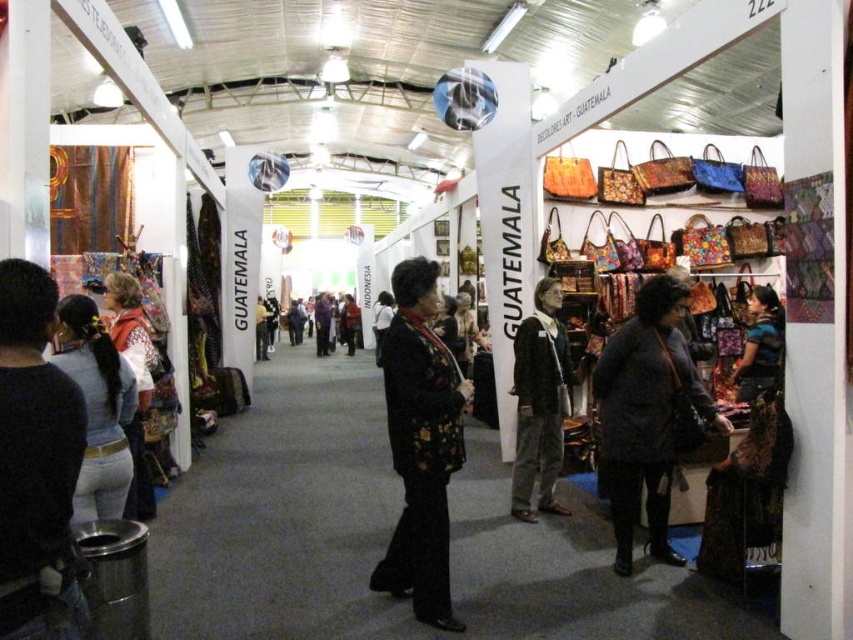
Question: Does black leather jacket at lower left come in front of red velvet coat at center?

Choices:
 (A) no
 (B) yes

Answer: (B)

Question: Can you confirm if black leather jacket at lower left is positioned above dark brown leather jacket at center?

Choices:
 (A) no
 (B) yes

Answer: (B)

Question: Among these points, which one is nearest to the camera?

Choices:
 (A) (746, 371)
 (B) (21, 296)
 (C) (140, 385)
 (D) (521, 396)

Answer: (B)

Question: In this image, where is white knitwear at left located relative to patterned fabric dress at center?

Choices:
 (A) left
 (B) right

Answer: (A)

Question: Which of the following is the farthest from the observer?

Choices:
 (A) patterned fabric dress at center
 (B) dark brown leather jacket at center

Answer: (A)

Question: Among these objects, which one is nearest to the camera?

Choices:
 (A) red velvet coat at center
 (B) patterned fabric dress at center

Answer: (B)